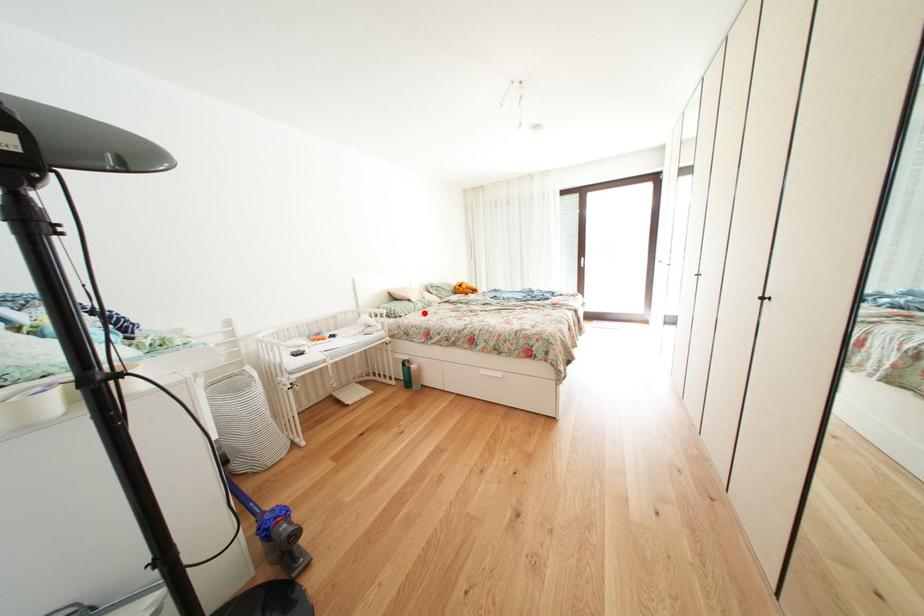
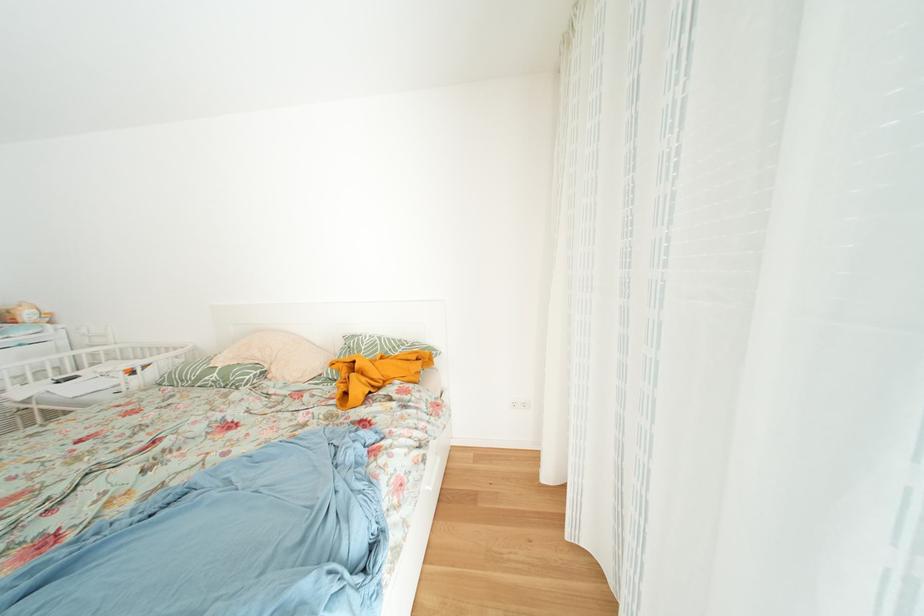
The point at the highlighted location is marked in the first image. Where is the corresponding point in the second image?

(208, 384)